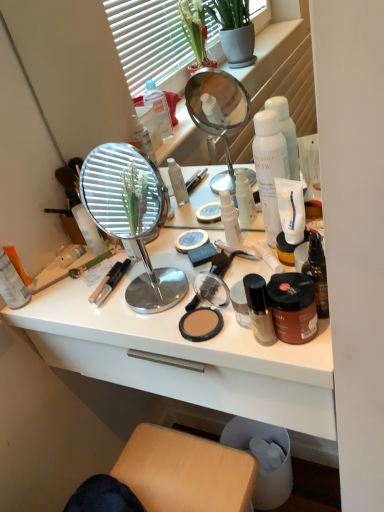
Locate an element on the screen. The width and height of the screenshot is (384, 512). unoccupied region to the right of matte black brush at lower left is located at coordinates (137, 262).